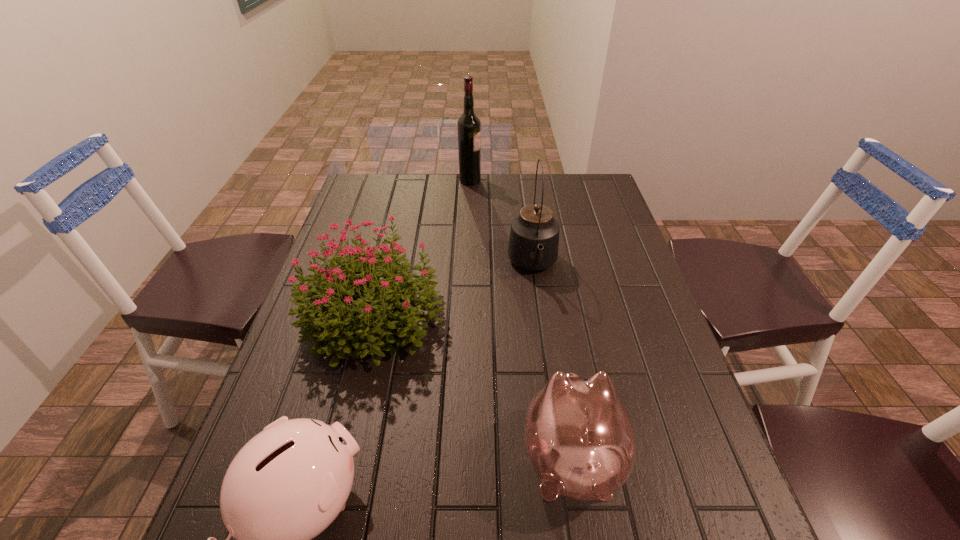
I want to click on vacant region between the bouquet and the farthest object, so click(421, 247).

Image resolution: width=960 pixels, height=540 pixels. Identify the location of free spot between the kettle and the wine bottle. (501, 223).

Locate an element on the screen. unoccupied position between the bouquet and the tallest object is located at coordinates (421, 247).

Image resolution: width=960 pixels, height=540 pixels. What are the coordinates of `free space that is in between the third object from right to left and the bouquet` in the screenshot? It's located at (421, 247).

I want to click on the second closest object to the right piggy bank, so click(x=286, y=485).

Image resolution: width=960 pixels, height=540 pixels. What are the coordinates of `object identified as the third closest to the tallest object` in the screenshot? It's located at (580, 440).

The image size is (960, 540). I want to click on free space in the image that satisfies the following two spatial constraints: 1. on the front facing side of the right piggy bank; 2. on the front and back of the third object from left to right, so click(x=527, y=180).